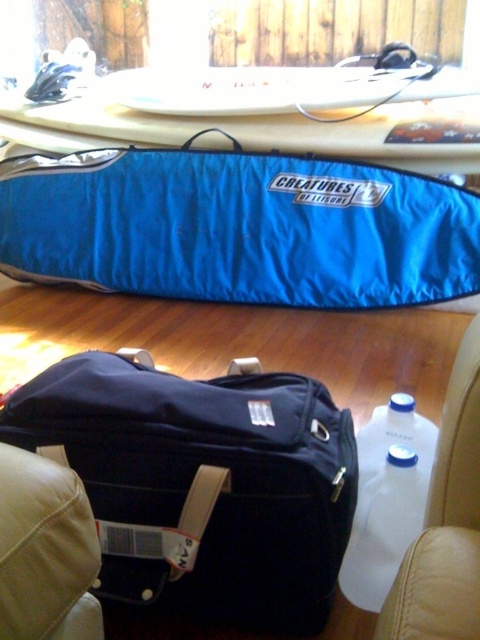
Question: Which point is farther to the camera?

Choices:
 (A) white plastic bottle at lower right
 (B) leather at lower right

Answer: (A)

Question: Can you confirm if blue fabric surfboard at upper center is smaller than white glossy surfboard at upper center?

Choices:
 (A) yes
 (B) no

Answer: (B)

Question: Among these points, which one is farthest from the camera?

Choices:
 (A) (443, 483)
 (B) (267, 77)
 (C) (276, 260)
 (D) (460, 92)

Answer: (B)

Question: In this image, where is blue fabric kayak at center located relative to blue fabric surfboard at upper center?

Choices:
 (A) right
 (B) left

Answer: (B)

Question: Among these objects, which one is nearest to the camera?

Choices:
 (A) white glossy surfboard at upper center
 (B) blue fabric surfboard at upper center
 (C) white plastic bottle at lower right

Answer: (C)

Question: Can you confirm if navy blue fabric suitcase at center is smaller than blue fabric kayak at center?

Choices:
 (A) no
 (B) yes

Answer: (B)